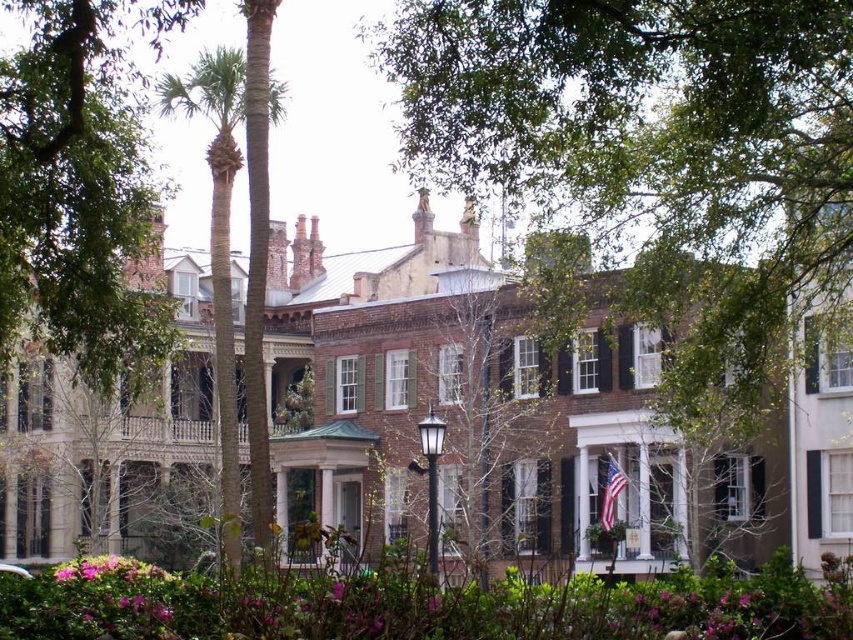
Question: Does brown brick mansion at center have a lesser width compared to green leafy tree at upper left?

Choices:
 (A) yes
 (B) no

Answer: (B)

Question: Can you confirm if green leafy tree at upper center is positioned below green leafy palm tree at center?

Choices:
 (A) yes
 (B) no

Answer: (B)

Question: Among these points, which one is nearest to the camera?

Choices:
 (A) (723, 86)
 (B) (20, 76)
 (C) (230, 432)
 (D) (297, 314)

Answer: (A)

Question: Can you confirm if brown brick mansion at center is positioned below green leafy tree at upper left?

Choices:
 (A) no
 (B) yes

Answer: (B)

Question: Which of the following is the farthest from the observer?

Choices:
 (A) (282, 282)
 (B) (227, 467)
 (C) (669, 51)

Answer: (A)

Question: Among these objects, which one is farthest from the camera?

Choices:
 (A) green leafy palm tree at center
 (B) green leafy tree at upper center
 (C) green leafy tree at upper left

Answer: (A)